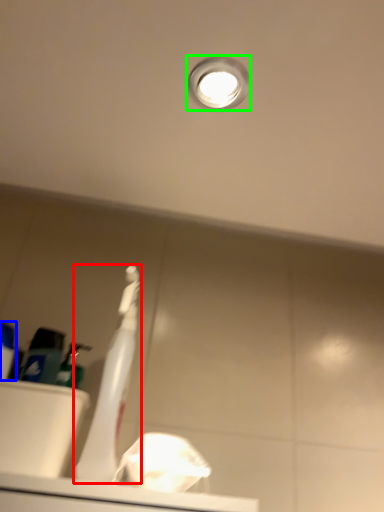
Question: Which object is the closest to the toothbrush (highlighted by a red box)? Choose among these: toiletry (highlighted by a blue box) or droplight (highlighted by a green box).

Choices:
 (A) toiletry
 (B) droplight

Answer: (A)